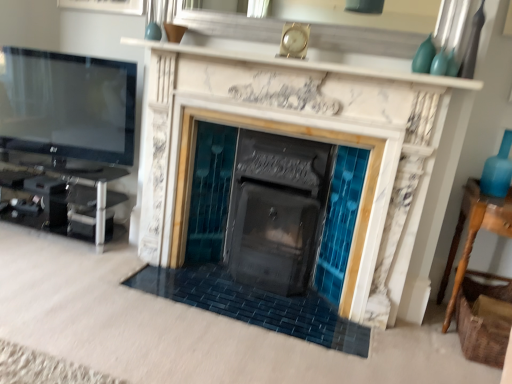
Question: In the image, is turquoise glass vase at upper right, which is the first turquoise from front to back, on the left side or the right side of matte glass vase at upper right, which is the 1th turquoise in back-to-front order?

Choices:
 (A) right
 (B) left

Answer: (A)

Question: Considering their positions, is turquoise glass vase at upper right, which is the second turquoise in back-to-front order, located in front of or behind matte glass vase at upper right, which is the 1th turquoise in back-to-front order?

Choices:
 (A) front
 (B) behind

Answer: (A)

Question: Which is nearer to the flat screen tv at left?

Choices:
 (A) blue glass vase at right
 (B) black glossy entertainment center at left
 (C) white marble mantle at upper center
 (D) wooden table at right
 (E) turquoise glass vase at upper right, which is the first turquoise from front to back

Answer: (B)

Question: Based on their relative distances, which object is nearer to the flat screen tv at left?

Choices:
 (A) black glossy entertainment center at left
 (B) wooden table at right
 (C) matte glass vase at upper right, positioned as the 2th turquoise in front-to-back order
 (D) marble fireplace at center
 (E) white marble mantle at upper center

Answer: (A)